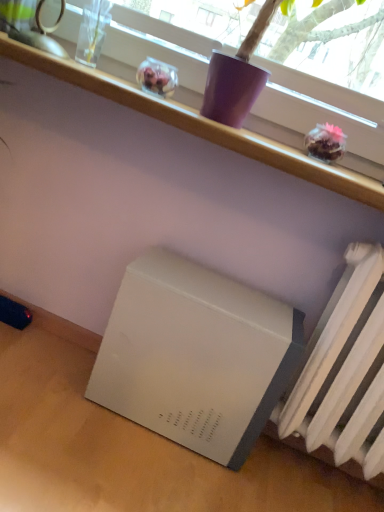
What is the approximate width of white matte radiator at lower right?

The width of white matte radiator at lower right is 9.41 inches.

In order to face white matte refrigerator at lower left, should I rotate leftwards or rightwards?

Turn right by 0.045 degrees to look at white matte refrigerator at lower left.

Identify the location of white matte radiator at lower right. Image resolution: width=384 pixels, height=512 pixels. 343,368.

Is white matte table at lower right looking in the opposite direction of white matte refrigerator at lower left?

white matte table at lower right does not have its back to white matte refrigerator at lower left.

Locate an element on the screen. The width and height of the screenshot is (384, 512). appliance above the white matte table at lower right (from the image's perspective) is located at coordinates (195, 356).

From the image's perspective, is white matte table at lower right on top of white matte refrigerator at lower left?

Actually, white matte table at lower right appears below white matte refrigerator at lower left in the image.

Considering the points (6, 342) and (111, 322), which point is in front, point (6, 342) or point (111, 322)?

Positioned in front is point (111, 322).

Which of these two, white matte refrigerator at lower left or white matte table at lower right, stands taller?

With more height is white matte refrigerator at lower left.

How far apart are white matte refrigerator at lower left and white matte table at lower right?

9.32 inches.

Between white matte refrigerator at lower left and white matte table at lower right, which one appears on the left side from the viewer's perspective?

Positioned to the left is white matte table at lower right.

In the scene shown: Could white matte radiator at lower right be considered to be inside white plastic shelf at upper center?

No, white matte radiator at lower right is not a part of white plastic shelf at upper center.

From the image's perspective, is white plastic shelf at upper center below white matte radiator at lower right?

Actually, white plastic shelf at upper center appears above white matte radiator at lower right in the image.

Identify the location of radiator that is in front of the white plastic shelf at upper center. The width and height of the screenshot is (384, 512). (343, 368).

Considering the relative positions of white plastic shelf at upper center and white matte radiator at lower right in the image provided, is white plastic shelf at upper center to the left or to the right of white matte radiator at lower right?

In the image, white plastic shelf at upper center appears on the left side of white matte radiator at lower right.

From the image's perspective, which one is positioned higher, white matte table at lower right or white plastic shelf at upper center?

white plastic shelf at upper center is shown above in the image.

How distant is white matte table at lower right from white plastic shelf at upper center?

white matte table at lower right and white plastic shelf at upper center are 31.49 inches apart.

Is white matte table at lower right behind white plastic shelf at upper center?

No, white matte table at lower right is closer to the camera.

Considering the positions of objects white matte table at lower right and white plastic shelf at upper center in the image provided, who is more to the left, white matte table at lower right or white plastic shelf at upper center?

white matte table at lower right is more to the left.

Would you consider white plastic shelf at upper center to be distant from white matte table at lower right?

Actually, white plastic shelf at upper center and white matte table at lower right are a little close together.

Consider the image. Is the depth of white plastic shelf at upper center less than that of white matte table at lower right?

No, the depth of white plastic shelf at upper center is greater than that of white matte table at lower right.

Considering the positions of objects white plastic shelf at upper center and white matte table at lower right in the image provided, who is more to the right, white plastic shelf at upper center or white matte table at lower right?

Positioned to the right is white plastic shelf at upper center.

How much distance is there between white plastic shelf at upper center and white matte table at lower right?

They are 31.49 inches apart.

From the image's perspective, which object appears higher, white matte refrigerator at lower left or white plastic shelf at upper center?

white plastic shelf at upper center, from the image's perspective.

Which object is positioned more to the left, white matte refrigerator at lower left or white plastic shelf at upper center?

From the viewer's perspective, white plastic shelf at upper center appears more on the left side.

In terms of width, does white matte refrigerator at lower left look wider or thinner when compared to white plastic shelf at upper center?

Considering their sizes, white matte refrigerator at lower left looks slimmer than white plastic shelf at upper center.

Does white matte refrigerator at lower left have a lesser height compared to white plastic shelf at upper center?

No.

Considering the sizes of white matte radiator at lower right and white plastic shelf at upper center in the image, is white matte radiator at lower right wider or thinner than white plastic shelf at upper center?

white matte radiator at lower right is thinner than white plastic shelf at upper center.

Which object is more forward, white matte radiator at lower right or white plastic shelf at upper center?

Positioned in front is white matte radiator at lower right.

How different are the orientations of white matte radiator at lower right and white plastic shelf at upper center in degrees?

The angular difference between white matte radiator at lower right and white plastic shelf at upper center is 1.01 degrees.

Locate an element on the screen. Image resolution: width=384 pixels, height=512 pixels. table directly beneath the white matte refrigerator at lower left (from a real-world perspective) is located at coordinates (133, 446).

You are a GUI agent. You are given a task and a screenshot of the screen. Output one action in this format:
    pyautogui.click(x=<x>, y=<y>)
    Task: Click on the appliance located above the white matte table at lower right (from a real-world perspective)
    
    Given the screenshot: What is the action you would take?
    pyautogui.click(x=195, y=356)

Based on their spatial positions, is white matte radiator at lower right or white plastic shelf at upper center closer to white matte table at lower right?

white matte radiator at lower right is closer to white matte table at lower right.

From the image, which object appears to be farther from white matte refrigerator at lower left, white matte table at lower right or white plastic shelf at upper center?

Based on the image, white plastic shelf at upper center appears to be further to white matte refrigerator at lower left.

Which object lies nearer to the anchor point white matte refrigerator at lower left, white plastic shelf at upper center or white matte radiator at lower right?

white matte radiator at lower right is closer to white matte refrigerator at lower left.

Based on their spatial positions, is white plastic shelf at upper center or white matte refrigerator at lower left closer to white matte table at lower right?

Based on the image, white matte refrigerator at lower left appears to be nearer to white matte table at lower right.

Estimate the real-world distances between objects in this image. Which object is closer to white matte refrigerator at lower left, white plastic shelf at upper center or white matte table at lower right?

white matte table at lower right lies closer to white matte refrigerator at lower left than the other object.

Estimate the real-world distances between objects in this image. Which object is closer to white matte table at lower right, white plastic shelf at upper center or white matte radiator at lower right?

white matte radiator at lower right.

From the picture: Which object lies further to the anchor point white matte radiator at lower right, white plastic shelf at upper center or white matte refrigerator at lower left?

white plastic shelf at upper center.

When comparing their distances from white matte refrigerator at lower left, does white matte radiator at lower right or white plastic shelf at upper center seem closer?

white matte radiator at lower right lies closer to white matte refrigerator at lower left than the other object.

Locate an element on the screen. radiator that lies between white plastic shelf at upper center and white matte table at lower right from top to bottom is located at coordinates (343, 368).

Where is `appliance between white plastic shelf at upper center and white matte table at lower right in the up-down direction`? The height and width of the screenshot is (512, 384). appliance between white plastic shelf at upper center and white matte table at lower right in the up-down direction is located at coordinates (195, 356).

Locate an element on the screen. This screenshot has height=512, width=384. appliance between white matte table at lower right and white matte radiator at lower right in the horizontal direction is located at coordinates (195, 356).

This screenshot has width=384, height=512. What are the coordinates of `appliance between white plastic shelf at upper center and white matte radiator at lower right in the up-down direction` in the screenshot? It's located at (195, 356).